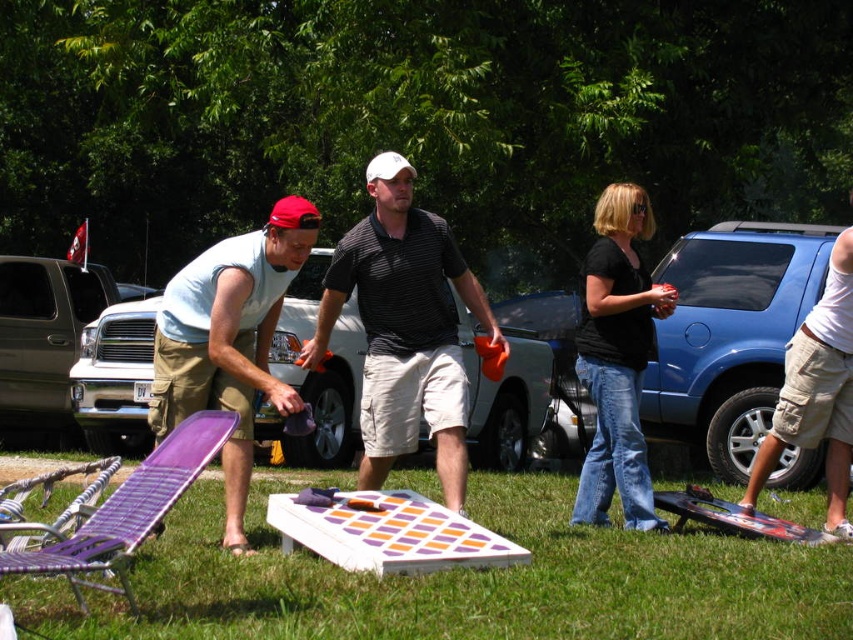
Question: Which object is closer to the camera taking this photo?

Choices:
 (A) green grass at center
 (B) matte light blue tank top at left

Answer: (A)

Question: Is matte light blue tank top at left closer to the viewer compared to purple wood board game at center?

Choices:
 (A) no
 (B) yes

Answer: (A)

Question: Does green grass at center have a greater width compared to white cotton shorts at right?

Choices:
 (A) yes
 (B) no

Answer: (A)

Question: Which point is farther from the camera taking this photo?

Choices:
 (A) (421, 273)
 (B) (691, 307)
 (C) (689, 497)
 (D) (657, 522)

Answer: (B)

Question: Which of these objects is positioned farthest from the blue metallic suv at center?

Choices:
 (A) black textured skateboard at lower right
 (B) purple wood board game at center
 (C) matte light blue tank top at left

Answer: (C)

Question: Can you confirm if blue metallic suv at center is thinner than white cotton shorts at right?

Choices:
 (A) no
 (B) yes

Answer: (B)